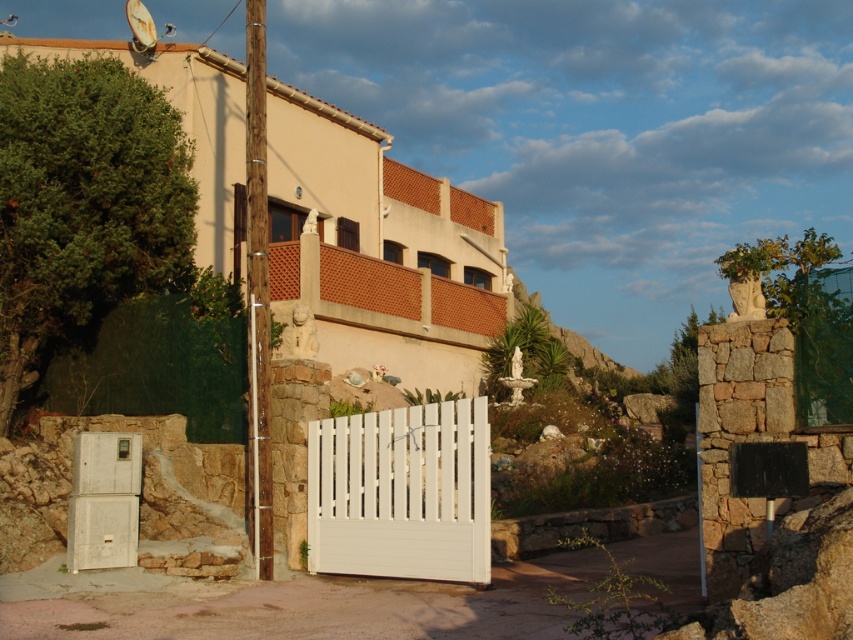
You are a delivery person with a large package that measures 8 feet in length. You are standing at the white matte refrigerator at lower left and need to move the package towards the white painted wood gate at center. Can you move the package through the space between them without bending or tilting it?

The distance between the white painted wood gate at center and the white matte refrigerator at lower left is 8.10 feet. Since the package is 8 feet long, there is enough space to move it through the 8.10 feet gap without bending or tilting.